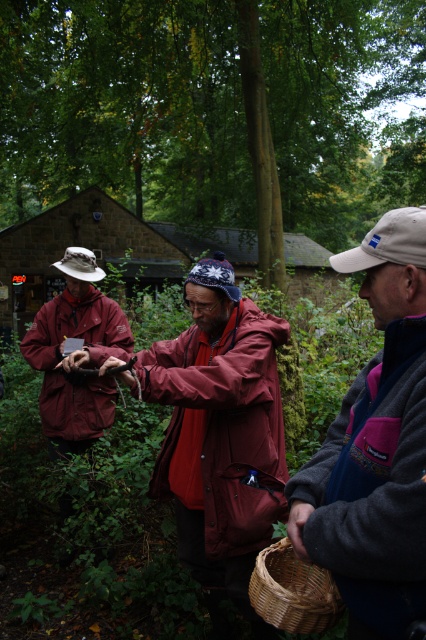
You are a photographer trying to capture a clear shot of the woven straw basket at lower center. There is a matte maroon jacket at left in the way. Based on their sizes, can you estimate if the jacket will block the basket in your photo?

The matte maroon jacket at left might be wider than woven straw basket at lower center, so there is a possibility that the jacket could block the basket in your photo.

In the scene shown: You are standing at the origin point in the image. Where is the gray fleece jacket at center located in terms of its 2D coordinates?

The gray fleece jacket at center is located at the 2D coordinates of point (374, 445).